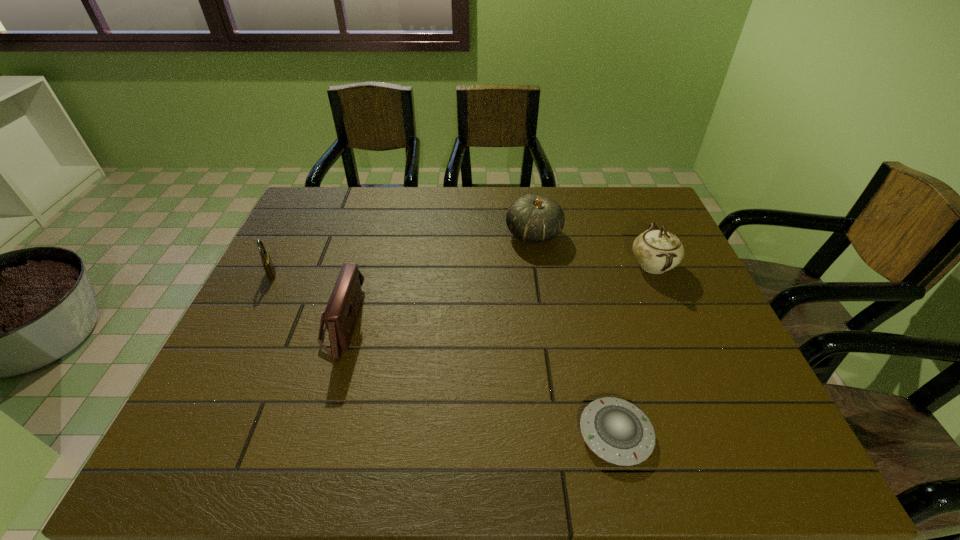
Image resolution: width=960 pixels, height=540 pixels. Find the location of `chinaware`. chinaware is located at coordinates (657, 251).

Find the location of `gourd`. gourd is located at coordinates (533, 219).

Identify the location of the second object from left to right. Image resolution: width=960 pixels, height=540 pixels. (340, 315).

I want to click on the leftmost object, so click(267, 263).

Locate an element on the screen. The image size is (960, 540). the shortest object is located at coordinates 612,428.

I want to click on the nearest object, so click(x=612, y=428).

Find the location of a particular element. Image resolution: width=960 pixels, height=540 pixels. free space located 0.360m on the left of the chinaware is located at coordinates (502, 265).

Find the location of `vacant space situated on the left of the gourd`. vacant space situated on the left of the gourd is located at coordinates (444, 234).

Locate an element on the screen. This screenshot has width=960, height=540. free space located 0.370m on the front flap of the shoulder bag is located at coordinates (509, 323).

Find the location of a particular element. Image resolution: width=960 pixels, height=540 pixels. blank space located on the right of the leftmost object is located at coordinates (302, 273).